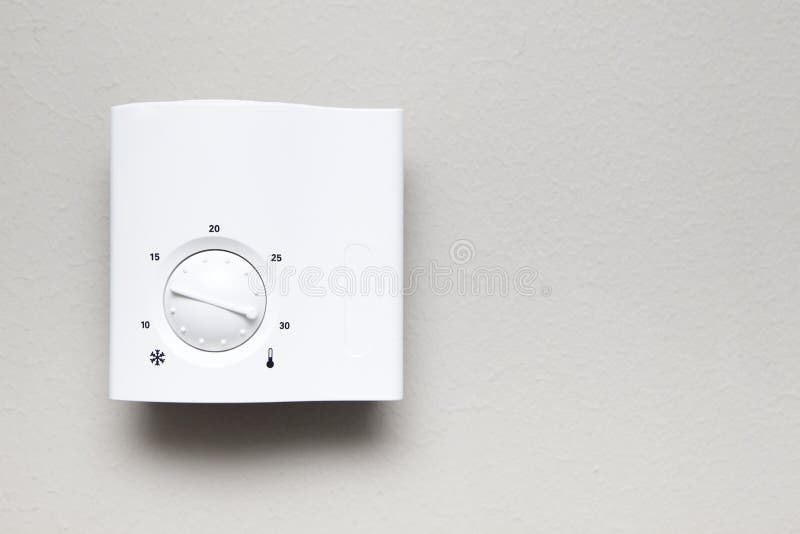
The image size is (800, 534). Identify the location of white wall. (638, 148).